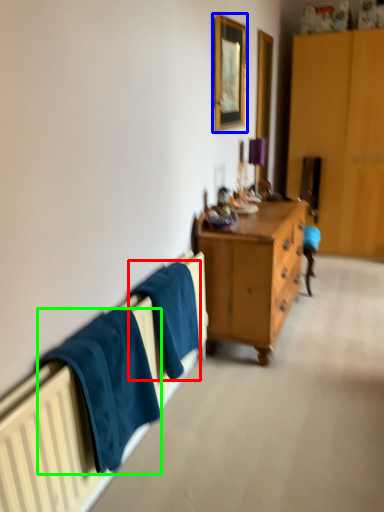
Question: Which object is positioned farthest from bath towel (highlighted by a red box)? Select from picture frame (highlighted by a blue box) and towel/napkin (highlighted by a green box).

Choices:
 (A) picture frame
 (B) towel/napkin

Answer: (A)